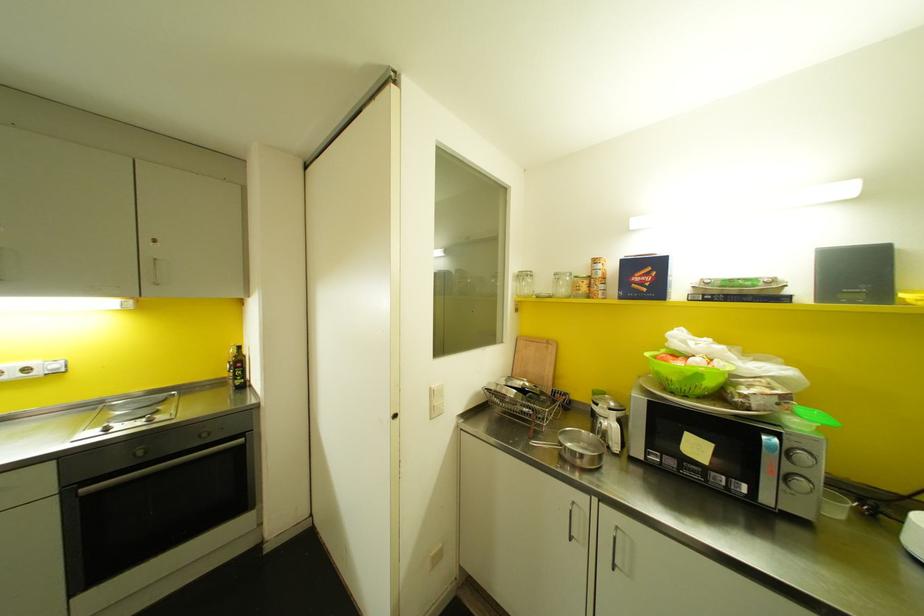
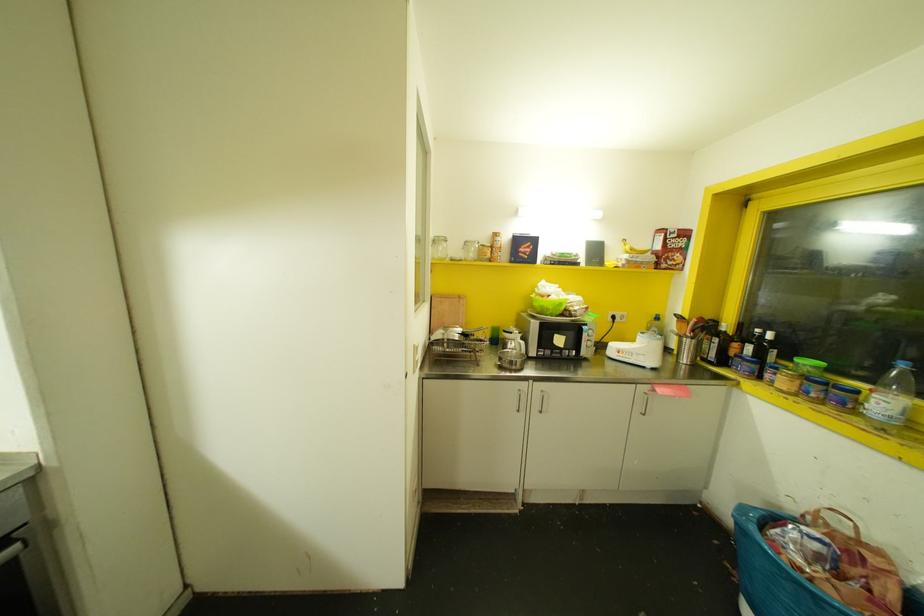
The point at (562, 290) is marked in the first image. Where is the corresponding point in the second image?

(470, 254)